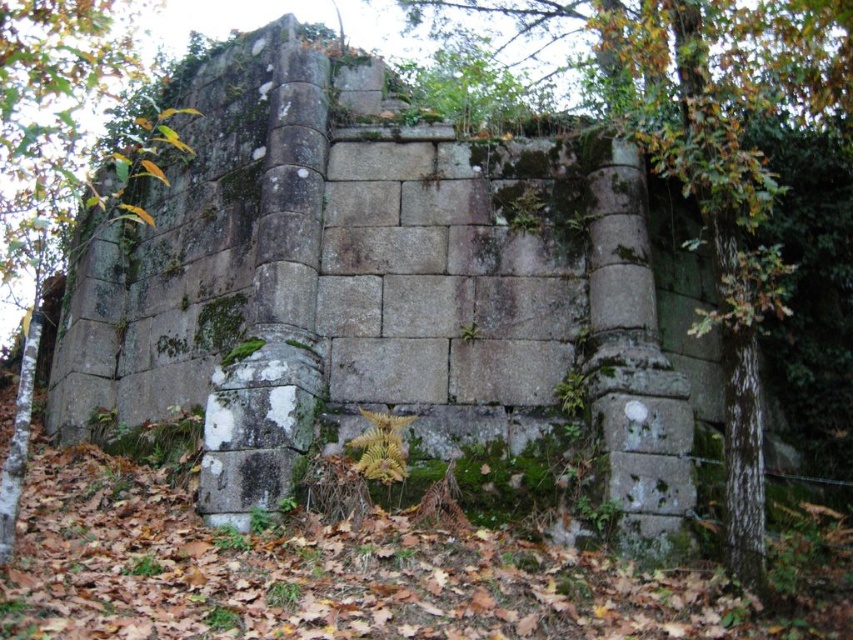
You are an archaeologist examining the ancient stone structure. You notice the green mossy tree at left and the green leafy ivy at center. Which one is located higher up relative to the other?

The green mossy tree at left is positioned over the green leafy ivy at center, so it is higher up.

You are an archaeologist examining the ancient stone structure. You notice the green mossy tree at left and the green leafy ivy at center. Which of these two plants has a greater width?

The green mossy tree at left has a greater width than the green leafy ivy at center.

You are standing at the origin point of the coordinate system. You want to move towards the green mossy stone pillar at center. What are the coordinates you need to move to reach it?

The coordinates to reach the green mossy stone pillar at center are point (x=712, y=168).